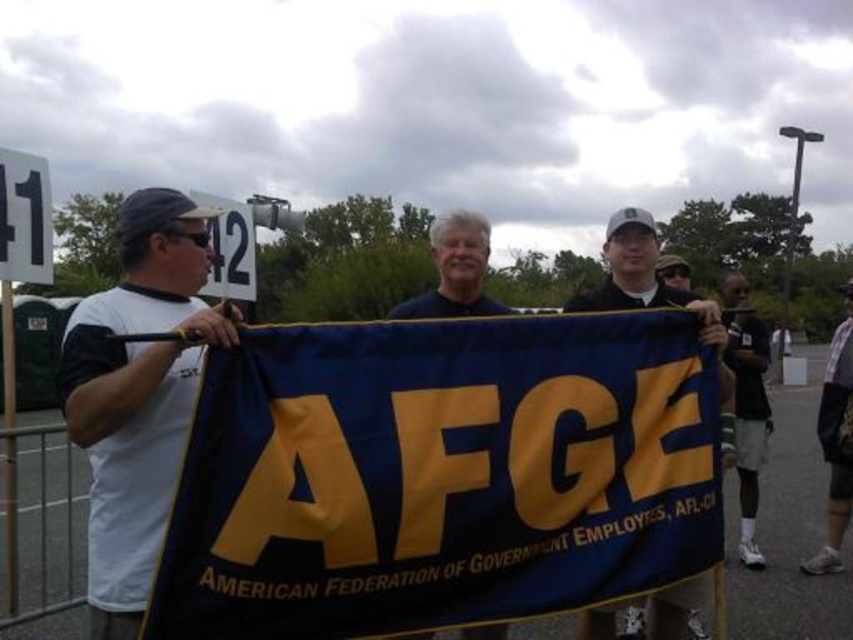
Question: Estimate the real-world distances between objects in this image. Which object is closer to the white matte t-shirt at left?

Choices:
 (A) blue fabric banner at center
 (B) dark blue jersey at right
 (C) blue fabric flag at center

Answer: (A)

Question: Which of the following is the farthest from the observer?

Choices:
 (A) dark blue jersey at right
 (B) blue fabric banner at center
 (C) white plastic sign at upper center
 (D) blue fabric flag at center

Answer: (C)

Question: Can you confirm if white matte t-shirt at left is positioned to the right of blue fabric flag at center?

Choices:
 (A) no
 (B) yes

Answer: (A)

Question: Can you confirm if blue/yellow fabric banner at center is bigger than blue fabric banner at center?

Choices:
 (A) yes
 (B) no

Answer: (B)

Question: Does blue fabric banner at center appear over black plastic sign at left?

Choices:
 (A) yes
 (B) no

Answer: (B)

Question: Which of the following is the farthest from the observer?

Choices:
 (A) (671, 301)
 (B) (1, 269)
 (C) (490, 625)

Answer: (B)